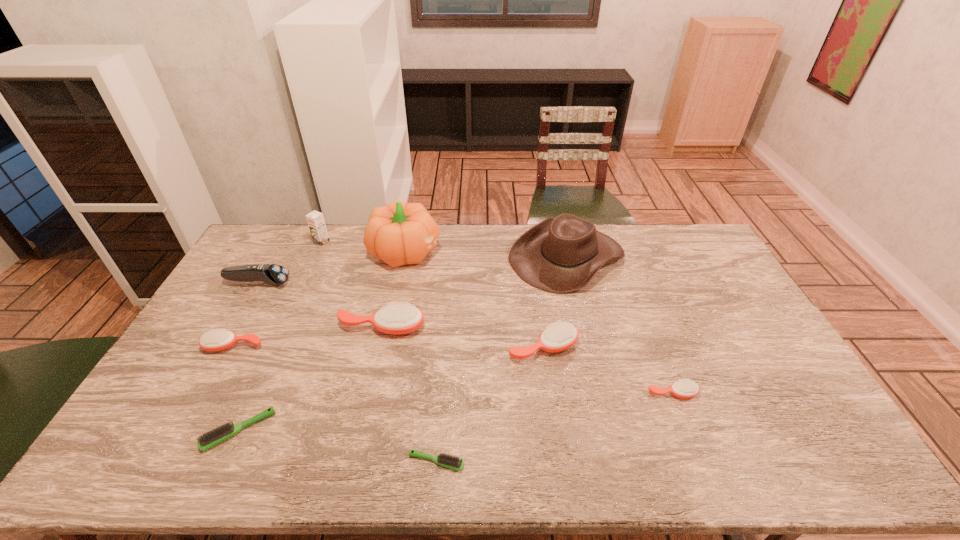
Locate an element on the screen. vacant area that lies between the third smallest orange hairbrush and the leftmost orange hairbrush is located at coordinates (389, 347).

In order to click on vacant region between the smaller light hairbrush and the electric shaver in this screenshot , I will do `click(348, 373)`.

In order to click on vacant point located between the cowboy hat and the second shortest hairbrush in this screenshot , I will do `click(402, 343)`.

Find the location of `vacant point located between the biggest orange hairbrush and the tallest object`. vacant point located between the biggest orange hairbrush and the tallest object is located at coordinates (394, 289).

Identify the location of object that is the third closest to the fourth hairbrush from right to left. This screenshot has height=540, width=960. (273, 274).

Identify which object is the second nearest to the rightmost orange hairbrush. Please provide its 2D coordinates. Your answer should be formatted as a tuple, i.e. [(x, y)], where the tuple contains the x and y coordinates of a point satisfying the conditions above.

[(559, 255)]

Identify the location of the closest hairbrush to the electric shaver. The height and width of the screenshot is (540, 960). (217, 339).

This screenshot has height=540, width=960. Identify the location of hairbrush that is the third closest one to the chocolate milk. (209, 439).

Locate an element on the screen. orange hairbrush object that ranks as the second closest to the leftmost orange hairbrush is located at coordinates (558, 337).

Where is `orange hairbrush that is the second closest to the second orange hairbrush from left to right`? This screenshot has width=960, height=540. orange hairbrush that is the second closest to the second orange hairbrush from left to right is located at coordinates (558, 337).